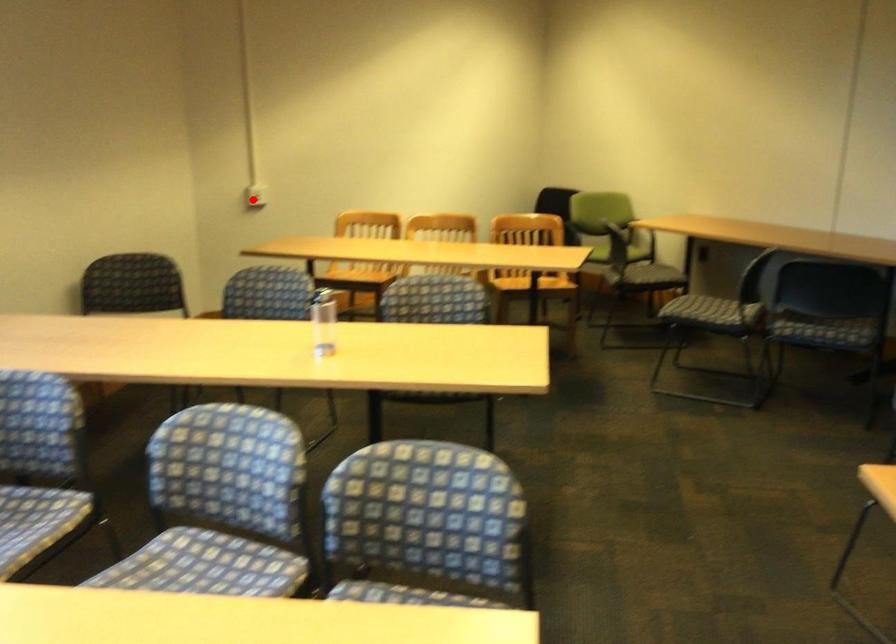
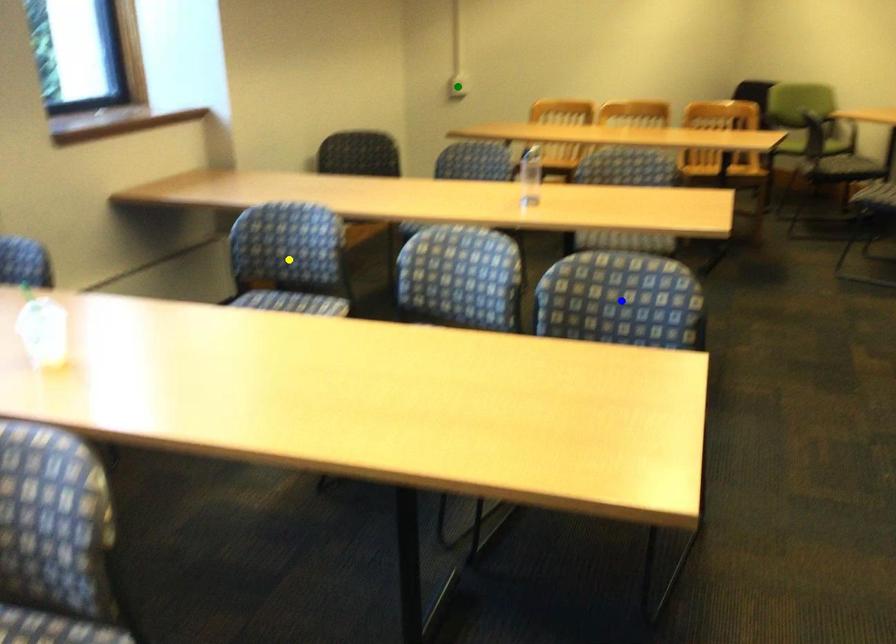
Question: I am providing you with two images of the same scene from different viewpoints. A red point is marked on the first image. You are given multiple points on the second image. Can you choose the point in image 2 that corresponds to the point in image 1?

Choices:
 (A) yellow point
 (B) blue point
 (C) green point

Answer: (C)